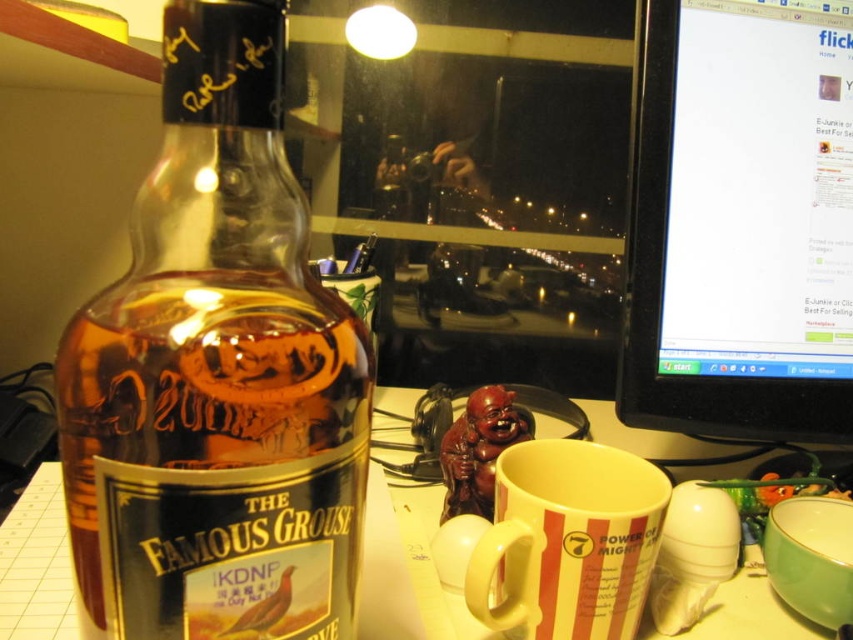
You are organizing items on a desk and need to place a new item between the translucent glass bottle at left and the white striped mug at center. Can you do this without moving either of them?

The translucent glass bottle at left is positioned on the left side of white striped mug at center, so there is space between them to place the new item without moving either of them.

You are a delivery robot with a package that needs to be placed on the desk. The package is 6 inches wide. Can you fit it between the white glossy table at lower center and the white striped mug at center without moving either object?

The distance between the white glossy table at lower center and the white striped mug at center is 5.39 inches, which is less than the package width of 6 inches. Therefore, the package cannot be placed between them without moving either object.